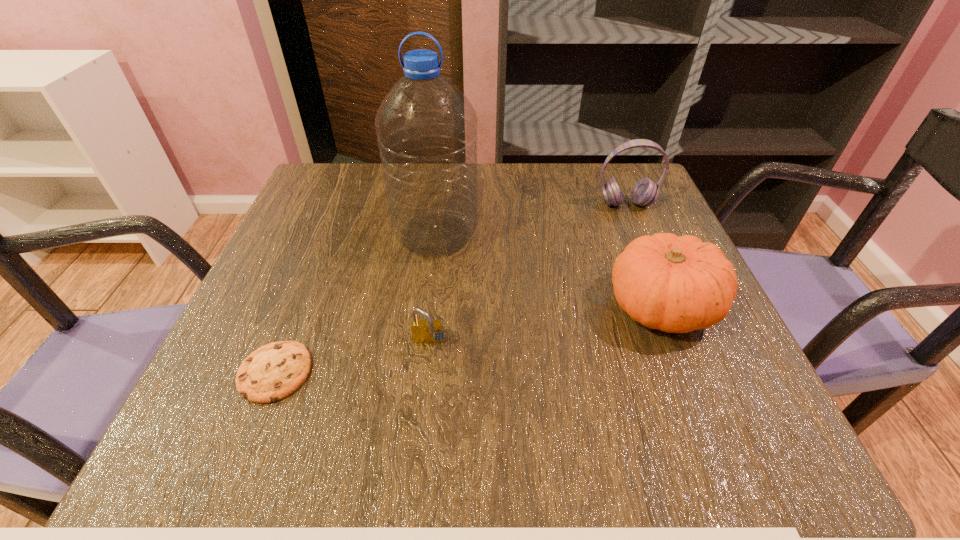
At what (x,y) coordinates should I click in order to perform the action: click on free space between the pumpkin and the tallest object. Please return your answer as a coordinate pair (x, y). The image size is (960, 540). Looking at the image, I should click on (548, 271).

Image resolution: width=960 pixels, height=540 pixels. In order to click on vacant area that lies between the pumpkin and the padlock in this screenshot , I will do `click(545, 325)`.

Locate an element on the screen. The width and height of the screenshot is (960, 540). blank region between the second shortest object and the pumpkin is located at coordinates (545, 325).

Select which object appears as the second closest to the second tallest object. Please provide its 2D coordinates. Your answer should be formatted as a tuple, i.e. [(x, y)], where the tuple contains the x and y coordinates of a point satisfying the conditions above.

[(426, 128)]

Locate an element on the screen. object that is the third closest one to the fourth shortest object is located at coordinates (427, 331).

This screenshot has height=540, width=960. Identify the location of vacant position in the image that satisfies the following two spatial constraints: 1. on the back side of the tallest object; 2. on the left side of the cookie. (329, 234).